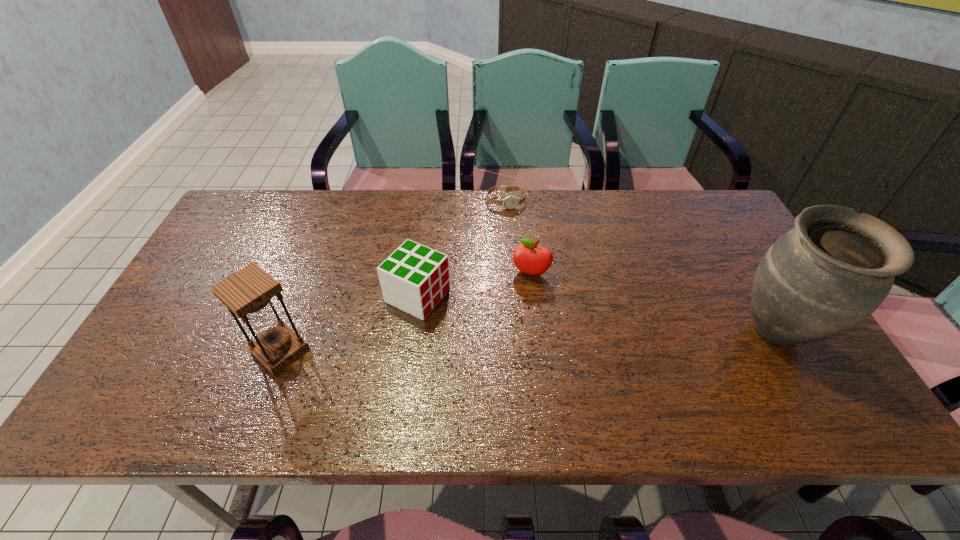
Find the location of a particular element. This screenshot has width=960, height=540. blank space at the far right corner of the desktop is located at coordinates (715, 215).

Where is `empty location between the shortest object and the cube`? The width and height of the screenshot is (960, 540). empty location between the shortest object and the cube is located at coordinates (462, 249).

Locate an element on the screen. free space between the hourglass and the tallest object is located at coordinates (529, 341).

Where is `free space between the hourglass and the cube`? The image size is (960, 540). free space between the hourglass and the cube is located at coordinates click(349, 323).

You are a GUI agent. You are given a task and a screenshot of the screen. Output one action in this format:
    pyautogui.click(x=<x>, y=<y>)
    Task: Click on the vacant space that is in between the second object from left to right and the watch
    The image size is (960, 540).
    Given the screenshot: What is the action you would take?
    pyautogui.click(x=462, y=249)

In order to click on empty space that is in between the urn and the apple in this screenshot , I will do click(x=655, y=303).

This screenshot has width=960, height=540. Identify the location of blank region between the farthest object and the cube. (462, 249).

Locate an element on the screen. empty space between the apple and the urn is located at coordinates (655, 303).

The image size is (960, 540). I want to click on vacant space that is in between the cube and the second tallest object, so click(349, 323).

This screenshot has width=960, height=540. I want to click on object that is the fourth closest to the second tallest object, so click(830, 272).